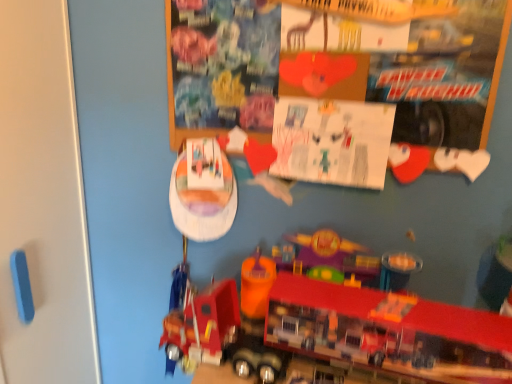
Measure the distance between wooden bulletin board at upper center and camera.

The depth of wooden bulletin board at upper center is 36.50 inches.

Locate an element on the screen. This screenshot has height=384, width=512. white paper at upper center is located at coordinates (332, 141).

The height and width of the screenshot is (384, 512). I want to click on metallic red truck at lower center, so click(x=331, y=331).

Considering the sizes of objects wooden bulletin board at upper center and metallic red truck at lower center in the image provided, who is thinner, wooden bulletin board at upper center or metallic red truck at lower center?

wooden bulletin board at upper center.

In the scene shown: How much distance is there between wooden bulletin board at upper center and metallic red truck at lower center?

wooden bulletin board at upper center is 46.40 centimeters from metallic red truck at lower center.

Consider the image. Considering the positions of objects wooden bulletin board at upper center and metallic red truck at lower center in the image provided, who is more to the left, wooden bulletin board at upper center or metallic red truck at lower center?

metallic red truck at lower center.

Is wooden bulletin board at upper center further to camera compared to metallic red truck at lower center?

That is True.

Is the position of white paper at upper center less distant than that of metallic red truck at lower center?

No, it is behind metallic red truck at lower center.

Between white paper at upper center and metallic red truck at lower center, which one has more height?

Standing taller between the two is white paper at upper center.

Which is in front, point (359, 168) or point (476, 355)?

Point (476, 355)

Between white paper at upper center and metallic red truck at lower center, which one has larger size?

metallic red truck at lower center.

Is wooden bulletin board at upper center beside white paper at upper center?

No, wooden bulletin board at upper center is not in contact with white paper at upper center.

In order to click on poster page to the right of wooden bulletin board at upper center in this screenshot , I will do `click(332, 141)`.

Is wooden bulletin board at upper center to the left of white paper at upper center from the viewer's perspective?

Yes, wooden bulletin board at upper center is to the left of white paper at upper center.

Could you tell me if metallic red truck at lower center is turned towards wooden bulletin board at upper center?

No, metallic red truck at lower center is not facing towards wooden bulletin board at upper center.

Considering the sizes of objects metallic red truck at lower center and wooden bulletin board at upper center in the image provided, who is thinner, metallic red truck at lower center or wooden bulletin board at upper center?

Answer: Thinner between the two is wooden bulletin board at upper center.

Is point (372, 294) positioned before point (236, 8)?

Yes, it is.

Is wooden bulletin board at upper center located within metallic red truck at lower center?

Actually, wooden bulletin board at upper center is outside metallic red truck at lower center.

From the image's perspective, which is above, white paper at upper center or wooden bulletin board at upper center?

wooden bulletin board at upper center appears higher in the image.

In the image, is white paper at upper center positioned in front of or behind wooden bulletin board at upper center?

In the image, white paper at upper center appears behind wooden bulletin board at upper center.

Choose the correct answer: Is white paper at upper center inside wooden bulletin board at upper center or outside it?

white paper at upper center fits inside wooden bulletin board at upper center.

Is white paper at upper center far away from wooden bulletin board at upper center?

white paper at upper center is near wooden bulletin board at upper center, not far away.

Identify the location of toy in front of the white paper at upper center. (331, 331).

Could you tell me if metallic red truck at lower center is facing white paper at upper center?

No, metallic red truck at lower center is not oriented towards white paper at upper center.

Would you say metallic red truck at lower center is outside white paper at upper center?

That's correct, metallic red truck at lower center is outside of white paper at upper center.

What's the angular difference between metallic red truck at lower center and white paper at upper center's facing directions?

The facing directions of metallic red truck at lower center and white paper at upper center are 5.06 degrees apart.

Locate an element on the screen. Image resolution: width=512 pixels, height=384 pixels. bulletin board located on the right of metallic red truck at lower center is located at coordinates (335, 66).

Locate an element on the screen. toy located below the white paper at upper center (from the image's perspective) is located at coordinates (331, 331).

Which object lies nearer to the anchor point white paper at upper center, metallic red truck at lower center or wooden bulletin board at upper center?

wooden bulletin board at upper center.

Considering their positions, is wooden bulletin board at upper center positioned closer to white paper at upper center than metallic red truck at lower center?

Among the two, wooden bulletin board at upper center is located nearer to white paper at upper center.

Estimate the real-world distances between objects in this image. Which object is closer to wooden bulletin board at upper center, metallic red truck at lower center or white paper at upper center?

Based on the image, white paper at upper center appears to be nearer to wooden bulletin board at upper center.

Based on their spatial positions, is wooden bulletin board at upper center or white paper at upper center closer to metallic red truck at lower center?

white paper at upper center is closer to metallic red truck at lower center.

Consider the image. From the image, which object appears to be nearer to wooden bulletin board at upper center, white paper at upper center or metallic red truck at lower center?

white paper at upper center is positioned closer to the anchor wooden bulletin board at upper center.

Which object lies further to the anchor point metallic red truck at lower center, white paper at upper center or wooden bulletin board at upper center?

wooden bulletin board at upper center.

I want to click on poster page between wooden bulletin board at upper center and metallic red truck at lower center in the vertical direction, so click(332, 141).